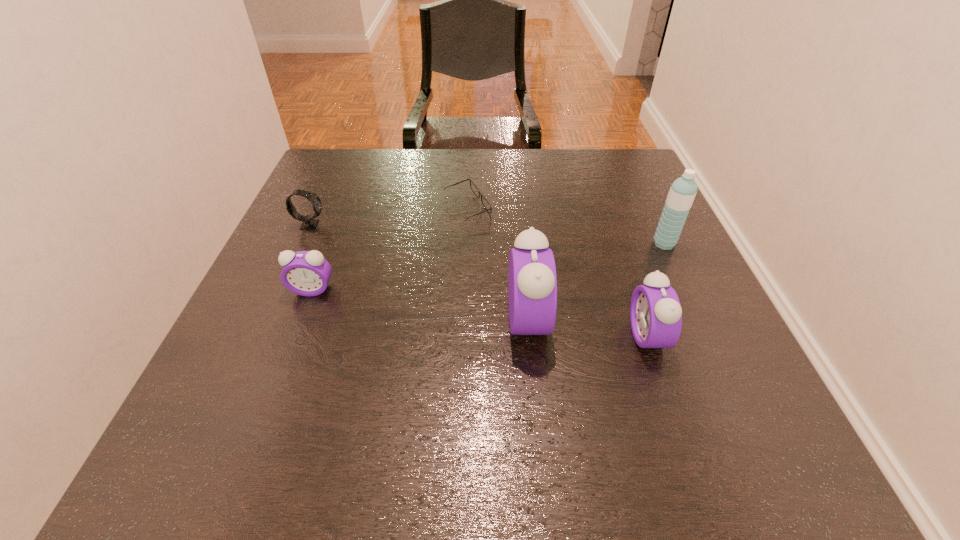
Locate an element on the screen. free space that is in between the third object from right to left and the shortest alarm clock is located at coordinates (420, 305).

In order to click on unoccupied area between the tallest alarm clock and the shortest alarm clock in this screenshot , I will do `click(420, 305)`.

Locate an element on the screen. blank region between the rightmost object and the watch is located at coordinates (487, 234).

Where is `vacant area that lies between the water bottle and the watch`? This screenshot has width=960, height=540. vacant area that lies between the water bottle and the watch is located at coordinates (487, 234).

Locate an element on the screen. The image size is (960, 540). vacant area that lies between the rightmost object and the shortest alarm clock is located at coordinates (489, 267).

At what (x,y) coordinates should I click in order to perform the action: click on free space between the rightmost object and the shortest object. Please return your answer as a coordinate pair (x, y). Image resolution: width=960 pixels, height=540 pixels. Looking at the image, I should click on click(565, 226).

I want to click on vacant space that's between the watch and the spectacles, so click(x=389, y=216).

Where is `free space between the shortest object and the tallest alarm clock`? The width and height of the screenshot is (960, 540). free space between the shortest object and the tallest alarm clock is located at coordinates (497, 264).

Identify which object is the fourth closest to the fourth object from left to right. Please provide its 2D coordinates. Your answer should be formatted as a tuple, i.e. [(x, y)], where the tuple contains the x and y coordinates of a point satisfying the conditions above.

[(307, 273)]

Identify the location of the second closest object relative to the shortest alarm clock. (487, 206).